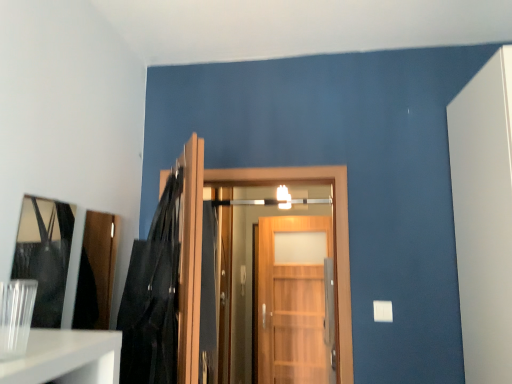
Question: Is satin silver door handle at center turned away from wooden door at center, arranged as the 3th door when viewed from the back?

Choices:
 (A) no
 (B) yes

Answer: (A)

Question: Is satin silver door handle at center to the left of wooden door at center, arranged as the 3th door when viewed from the back, from the viewer's perspective?

Choices:
 (A) no
 (B) yes

Answer: (A)

Question: Is satin silver door handle at center far away from wooden door at center, arranged as the 3th door when viewed from the back?

Choices:
 (A) yes
 (B) no

Answer: (A)

Question: From a real-world perspective, is satin silver door handle at center located beneath wooden door at center, arranged as the 3th door when viewed from the back?

Choices:
 (A) yes
 (B) no

Answer: (A)

Question: Is satin silver door handle at center touching wooden door at center, arranged as the 3th door when viewed from the back?

Choices:
 (A) no
 (B) yes

Answer: (A)

Question: Does satin silver door handle at center have a larger size compared to wooden door at center, the 1th door from the front?

Choices:
 (A) no
 (B) yes

Answer: (A)

Question: From a real-world perspective, is matte black mirror at left physically below black leather jacket at upper left?

Choices:
 (A) no
 (B) yes

Answer: (A)

Question: Does matte black mirror at left appear on the left side of black leather jacket at upper left?

Choices:
 (A) no
 (B) yes

Answer: (B)

Question: Is matte black mirror at left oriented towards black leather jacket at upper left?

Choices:
 (A) no
 (B) yes

Answer: (B)

Question: Is matte black mirror at left with black leather jacket at upper left?

Choices:
 (A) no
 (B) yes

Answer: (A)

Question: Could black leather jacket at upper left be considered to be inside matte black mirror at left?

Choices:
 (A) no
 (B) yes

Answer: (A)

Question: Is the position of matte black mirror at left more distant than that of black leather jacket at upper left?

Choices:
 (A) yes
 (B) no

Answer: (A)

Question: From the image's perspective, does wooden door at center, placed as the 2th door when sorted from front to back, appear lower than matte black mirror at left?

Choices:
 (A) yes
 (B) no

Answer: (A)